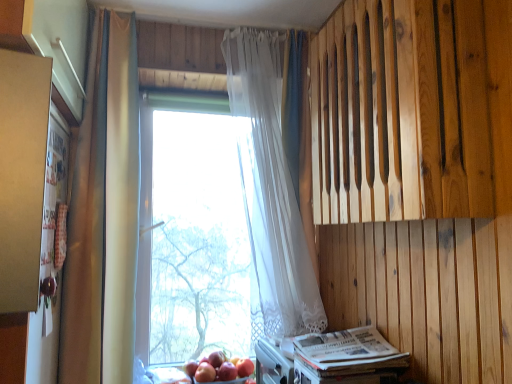
Image resolution: width=512 pixels, height=384 pixels. I want to click on red matte apple at lower center, marked as the third apple in a left-to-right arrangement, so click(244, 367).

This screenshot has width=512, height=384. What do you see at coordinates (192, 232) in the screenshot?
I see `transparent glass window at center` at bounding box center [192, 232].

I want to click on glossy red apple at lower center, which ranks as the second apple in right-to-left order, so click(227, 371).

How much space does red matte apple at lower center, placed as the 3th apple when sorted from right to left, occupy vertically?

red matte apple at lower center, placed as the 3th apple when sorted from right to left, is 2.53 inches tall.

Identify the location of red matte apple at lower center, acting as the 1th apple starting from the right. (244, 367).

Is glossy red apple at lower center, placed as the 2th apple when sorted from left to right, located outside red matte apple at lower center, acting as the 1th apple starting from the right?

glossy red apple at lower center, placed as the 2th apple when sorted from left to right, is positioned outside red matte apple at lower center, acting as the 1th apple starting from the right.

Is glossy red apple at lower center, placed as the 2th apple when sorted from left to right, shorter than red matte apple at lower center, marked as the third apple in a left-to-right arrangement?

Yes, glossy red apple at lower center, placed as the 2th apple when sorted from left to right, is shorter than red matte apple at lower center, marked as the third apple in a left-to-right arrangement.

From a real-world perspective, who is located lower, glossy red apple at lower center, which ranks as the second apple in right-to-left order, or red matte apple at lower center, marked as the third apple in a left-to-right arrangement?

glossy red apple at lower center, which ranks as the second apple in right-to-left order.

Is glossy red apple at lower center, placed as the 2th apple when sorted from left to right, surrounded by red matte apple at lower center, acting as the 1th apple starting from the right?

No, glossy red apple at lower center, placed as the 2th apple when sorted from left to right, is not inside red matte apple at lower center, acting as the 1th apple starting from the right.

Considering the sizes of objects red matte apple at lower center, acting as the 1th apple starting from the right, and glossy red apple at lower center, which ranks as the second apple in right-to-left order, in the image provided, who is smaller, red matte apple at lower center, acting as the 1th apple starting from the right, or glossy red apple at lower center, which ranks as the second apple in right-to-left order,?

Smaller between the two is glossy red apple at lower center, which ranks as the second apple in right-to-left order.

From the image's perspective, which one is positioned lower, red matte apple at lower center, acting as the 1th apple starting from the right, or glossy red apple at lower center, which ranks as the second apple in right-to-left order?

glossy red apple at lower center, which ranks as the second apple in right-to-left order, from the image's perspective.

Considering the positions of objects red matte apple at lower center, acting as the 1th apple starting from the right, and glossy red apple at lower center, placed as the 2th apple when sorted from left to right, in the image provided, who is more to the right, red matte apple at lower center, acting as the 1th apple starting from the right, or glossy red apple at lower center, placed as the 2th apple when sorted from left to right,?

red matte apple at lower center, acting as the 1th apple starting from the right.

Between red matte apple at lower center, acting as the 1th apple starting from the left, and matte gold curtain at left, arranged as the second curtain when viewed from the right, which one has smaller size?

red matte apple at lower center, acting as the 1th apple starting from the left, is smaller.

Is there a large distance between red matte apple at lower center, acting as the 1th apple starting from the left, and matte gold curtain at left, the first curtain when ordered from left to right?

No, red matte apple at lower center, acting as the 1th apple starting from the left, is not far away from matte gold curtain at left, the first curtain when ordered from left to right.

Which of these two, red matte apple at lower center, acting as the 1th apple starting from the left, or matte gold curtain at left, the first curtain when ordered from left to right, stands taller?

matte gold curtain at left, the first curtain when ordered from left to right, is taller.

From a real-world perspective, is red matte apple at lower center, acting as the 1th apple starting from the left, physically below matte gold curtain at left, arranged as the second curtain when viewed from the right?

Yes, from a real-world perspective, red matte apple at lower center, acting as the 1th apple starting from the left, is under matte gold curtain at left, arranged as the second curtain when viewed from the right.

Where is `apple that appears below the glossy red apple at lower center, placed as the 2th apple when sorted from left to right (from a real-world perspective)`? The width and height of the screenshot is (512, 384). apple that appears below the glossy red apple at lower center, placed as the 2th apple when sorted from left to right (from a real-world perspective) is located at coordinates (205, 373).

Is red matte apple at lower center, acting as the 1th apple starting from the left, positioned far away from glossy red apple at lower center, placed as the 2th apple when sorted from left to right?

No, red matte apple at lower center, acting as the 1th apple starting from the left, is not far from glossy red apple at lower center, placed as the 2th apple when sorted from left to right.

Can you confirm if red matte apple at lower center, acting as the 1th apple starting from the left, is bigger than glossy red apple at lower center, placed as the 2th apple when sorted from left to right?

Correct, red matte apple at lower center, acting as the 1th apple starting from the left, is larger in size than glossy red apple at lower center, placed as the 2th apple when sorted from left to right.

Is glossy red apple at lower center, placed as the 2th apple when sorted from left to right, a part of red matte apple at lower center, placed as the 3th apple when sorted from right to left?

Actually, glossy red apple at lower center, placed as the 2th apple when sorted from left to right, is outside red matte apple at lower center, placed as the 3th apple when sorted from right to left.

Could you tell me if white paper magazine at lower right is turned towards matte gold curtain at left, the first curtain when ordered from left to right?

No, white paper magazine at lower right is not oriented towards matte gold curtain at left, the first curtain when ordered from left to right.

Measure the distance from white paper magazine at lower right to matte gold curtain at left, arranged as the second curtain when viewed from the right.

A distance of 34.06 inches exists between white paper magazine at lower right and matte gold curtain at left, arranged as the second curtain when viewed from the right.

Which object is thinner, white paper magazine at lower right or matte gold curtain at left, the first curtain when ordered from left to right?

Thinner between the two is matte gold curtain at left, the first curtain when ordered from left to right.

From the image's perspective, is transparent glass window at center located above or below glossy red apple at lower center, which ranks as the second apple in right-to-left order?

From the image's perspective, transparent glass window at center appears above glossy red apple at lower center, which ranks as the second apple in right-to-left order.

Is transparent glass window at center bigger or smaller than glossy red apple at lower center, which ranks as the second apple in right-to-left order?

Clearly, transparent glass window at center is larger in size than glossy red apple at lower center, which ranks as the second apple in right-to-left order.

Is transparent glass window at center to the left of glossy red apple at lower center, placed as the 2th apple when sorted from left to right, from the viewer's perspective?

Indeed, transparent glass window at center is positioned on the left side of glossy red apple at lower center, placed as the 2th apple when sorted from left to right.

Starting from the transparent glass window at center, which apple is the 1st one in front? Please provide its 2D coordinates.

[(227, 371)]

From a real-world perspective, is natural wood paneling at upper right located beneath matte gold curtain at left, arranged as the second curtain when viewed from the right?

No, from a real-world perspective, natural wood paneling at upper right is not under matte gold curtain at left, arranged as the second curtain when viewed from the right.

Considering the relative positions of natural wood paneling at upper right and matte gold curtain at left, arranged as the second curtain when viewed from the right, in the image provided, is natural wood paneling at upper right to the left or to the right of matte gold curtain at left, arranged as the second curtain when viewed from the right,?

natural wood paneling at upper right is to the right of matte gold curtain at left, arranged as the second curtain when viewed from the right.

Which is in front, natural wood paneling at upper right or matte gold curtain at left, the first curtain when ordered from left to right?

natural wood paneling at upper right is closer to the camera.

Is natural wood paneling at upper right located outside matte gold curtain at left, the first curtain when ordered from left to right?

Yes, natural wood paneling at upper right is not within matte gold curtain at left, the first curtain when ordered from left to right.

The width and height of the screenshot is (512, 384). I want to click on apple above the glossy red apple at lower center, which ranks as the second apple in right-to-left order (from the image's perspective), so click(244, 367).

Identify the location of the 1st apple to the left of the red matte apple at lower center, marked as the third apple in a left-to-right arrangement, counting from the anchor's position. (227, 371).

When comparing their distances from matte gold curtain at left, arranged as the second curtain when viewed from the right, does glossy red apple at lower center, placed as the 2th apple when sorted from left to right, or natural wood paneling at upper right seem closer?

The object closer to matte gold curtain at left, arranged as the second curtain when viewed from the right, is glossy red apple at lower center, placed as the 2th apple when sorted from left to right.

Looking at the image, which one is located closer to white paper magazine at lower right, matte gold curtain at left, the first curtain when ordered from left to right, or natural wood paneling at upper right?

Among the two, natural wood paneling at upper right is located nearer to white paper magazine at lower right.

From the image, which object appears to be farther from natural wood paneling at upper right, matte gold curtain at left, the first curtain when ordered from left to right, or red matte apple at lower center, placed as the 3th apple when sorted from right to left?

Based on the image, red matte apple at lower center, placed as the 3th apple when sorted from right to left, appears to be further to natural wood paneling at upper right.

Based on their spatial positions, is transparent glass window at center or white sheer curtain at center, placed as the 1th curtain when sorted from right to left, further from white paper magazine at lower right?

Based on the image, transparent glass window at center appears to be further to white paper magazine at lower right.

Based on their spatial positions, is white sheer curtain at center, placed as the 1th curtain when sorted from right to left, or white paper magazine at lower right further from matte gold curtain at left, the first curtain when ordered from left to right?

white paper magazine at lower right lies further to matte gold curtain at left, the first curtain when ordered from left to right, than the other object.

Which object lies further to the anchor point red matte apple at lower center, acting as the 1th apple starting from the left, white paper magazine at lower right or natural wood paneling at upper right?

natural wood paneling at upper right is positioned further to the anchor red matte apple at lower center, acting as the 1th apple starting from the left.

Which object lies nearer to the anchor point white paper magazine at lower right, white sheer curtain at center, the second curtain positioned from the left, or red matte apple at lower center, acting as the 1th apple starting from the left?

Among the two, white sheer curtain at center, the second curtain positioned from the left, is located nearer to white paper magazine at lower right.

Considering their positions, is glossy red apple at lower center, placed as the 2th apple when sorted from left to right, positioned further to red matte apple at lower center, placed as the 3th apple when sorted from right to left, than transparent glass window at center?

transparent glass window at center is positioned further to the anchor red matte apple at lower center, placed as the 3th apple when sorted from right to left.

The image size is (512, 384). I want to click on apple between transparent glass window at center and glossy red apple at lower center, which ranks as the second apple in right-to-left order, vertically, so click(x=244, y=367).

You are a GUI agent. You are given a task and a screenshot of the screen. Output one action in this format:
    pyautogui.click(x=<x>, y=<y>)
    Task: Click on the curtain between white sheer curtain at center, placed as the 1th curtain when sorted from right to left, and red matte apple at lower center, acting as the 1th apple starting from the right, in the vertical direction
    This screenshot has width=512, height=384.
    Given the screenshot: What is the action you would take?
    pyautogui.click(x=103, y=215)

At what (x,y) coordinates should I click in order to perform the action: click on curtain between matte gold curtain at left, the first curtain when ordered from left to right, and white paper magazine at lower right, in the horizontal direction. Please return your answer as a coordinate pair (x, y). Image resolution: width=512 pixels, height=384 pixels. Looking at the image, I should click on (270, 187).

Locate an element on the screen. This screenshot has height=384, width=512. window between matte gold curtain at left, the first curtain when ordered from left to right, and white paper magazine at lower right is located at coordinates (192, 232).